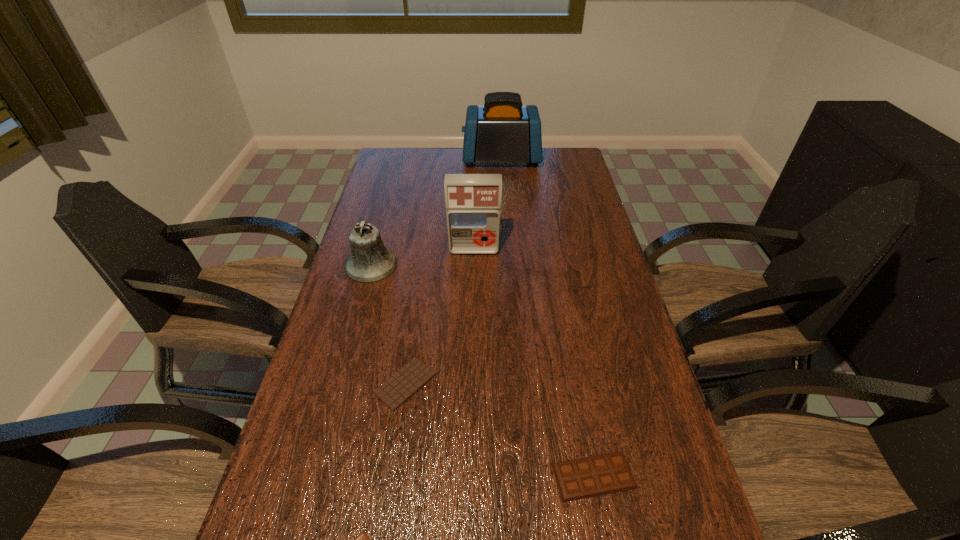
This screenshot has width=960, height=540. Identify the location of toaster. (503, 130).

I want to click on the first-aid kit, so click(473, 202).

Identify the location of bell. (370, 261).

Where is `the rightmost chocolate bar`? The image size is (960, 540). the rightmost chocolate bar is located at coordinates (598, 475).

Image resolution: width=960 pixels, height=540 pixels. What are the coordinates of `the second farthest chocolate bar` in the screenshot? It's located at [x=598, y=475].

The image size is (960, 540). Identify the location of the fifth tallest object. (394, 392).

The image size is (960, 540). Find the location of `the farthest chocolate bar`. the farthest chocolate bar is located at coordinates (394, 392).

Where is `free space located on the front-facing side of the farthest object`? This screenshot has height=540, width=960. free space located on the front-facing side of the farthest object is located at coordinates (422, 159).

Where is `free space located 0.150m on the front-facing side of the farthest object`? Image resolution: width=960 pixels, height=540 pixels. free space located 0.150m on the front-facing side of the farthest object is located at coordinates (427, 159).

Image resolution: width=960 pixels, height=540 pixels. What are the coordinates of `vacant space located 0.130m on the front-facing side of the farthest object` in the screenshot? It's located at (432, 159).